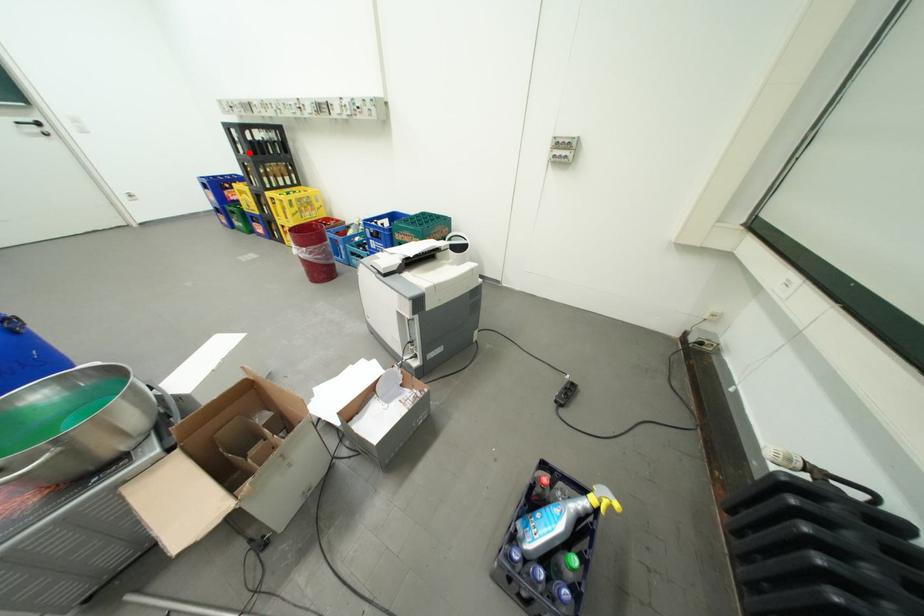
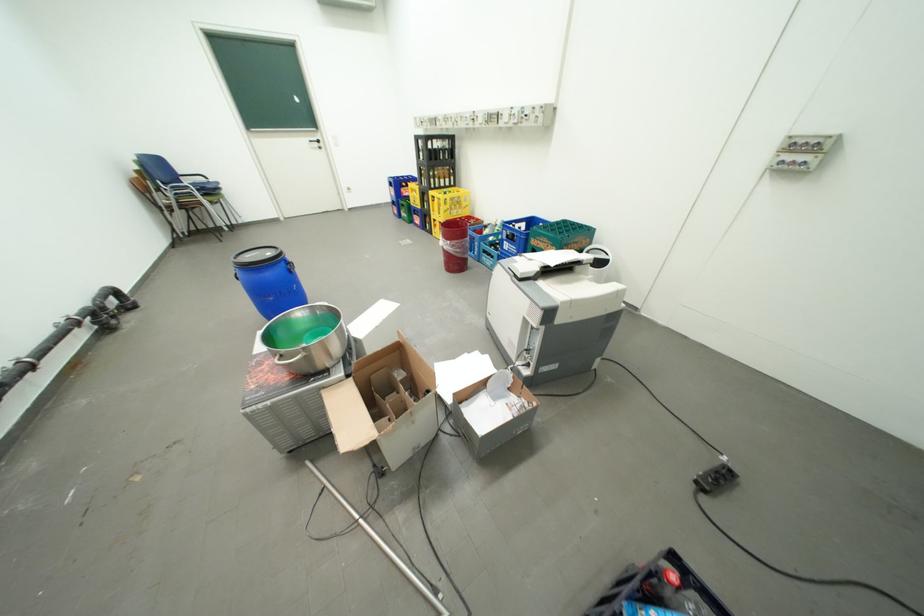
Locate, in the second image, the point that corresponds to the highlighted location in the first image.

(430, 159)